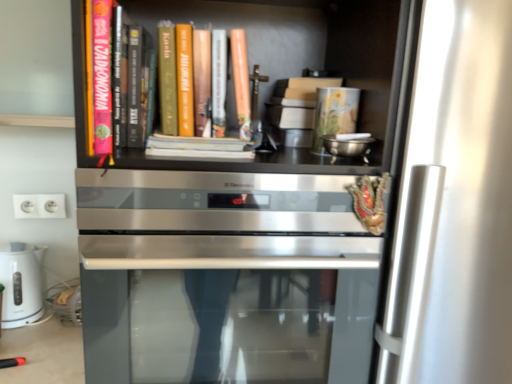
Find the location of a particular element. The height and width of the screenshot is (384, 512). vacant area that lies in front of matte orange book at center, positioned as the second book in left-to-right order is located at coordinates 184,171.